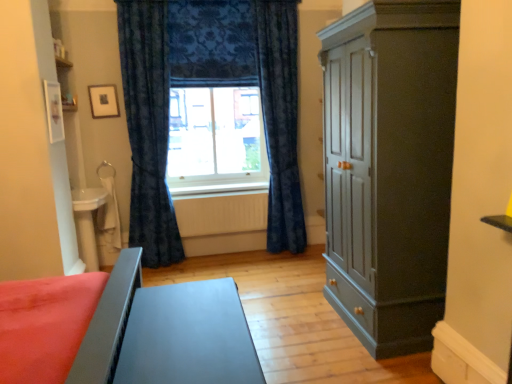
Question: Is wooden picture frame at upper left with white painted wood at center?

Choices:
 (A) no
 (B) yes

Answer: (A)

Question: Does wooden picture frame at upper left have a smaller size compared to white painted wood at center?

Choices:
 (A) no
 (B) yes

Answer: (B)

Question: Is white painted wood at center surrounded by wooden picture frame at upper left?

Choices:
 (A) yes
 (B) no

Answer: (B)

Question: Is wooden picture frame at upper left oriented away from white painted wood at center?

Choices:
 (A) yes
 (B) no

Answer: (B)

Question: Does wooden picture frame at upper left appear on the right side of white painted wood at center?

Choices:
 (A) no
 (B) yes

Answer: (A)

Question: Is wooden picture frame at upper left bigger than white painted wood at center?

Choices:
 (A) yes
 (B) no

Answer: (B)

Question: Is matte dark gray cupboard at right in front of yellow matte radiator at center?

Choices:
 (A) yes
 (B) no

Answer: (A)

Question: Considering the relative sizes of matte dark gray cupboard at right and yellow matte radiator at center in the image provided, is matte dark gray cupboard at right bigger than yellow matte radiator at center?

Choices:
 (A) yes
 (B) no

Answer: (A)

Question: From the image's perspective, would you say matte dark gray cupboard at right is positioned over yellow matte radiator at center?

Choices:
 (A) yes
 (B) no

Answer: (A)

Question: Is yellow matte radiator at center a part of matte dark gray cupboard at right?

Choices:
 (A) no
 (B) yes

Answer: (A)

Question: Does matte dark gray cupboard at right have a greater width compared to yellow matte radiator at center?

Choices:
 (A) yes
 (B) no

Answer: (A)

Question: Does matte dark gray cupboard at right lie behind yellow matte radiator at center?

Choices:
 (A) no
 (B) yes

Answer: (A)

Question: From the image's perspective, is wooden picture frame at upper left over matte gray table at lower left, arranged as the 1th table when viewed from the back?

Choices:
 (A) no
 (B) yes

Answer: (B)